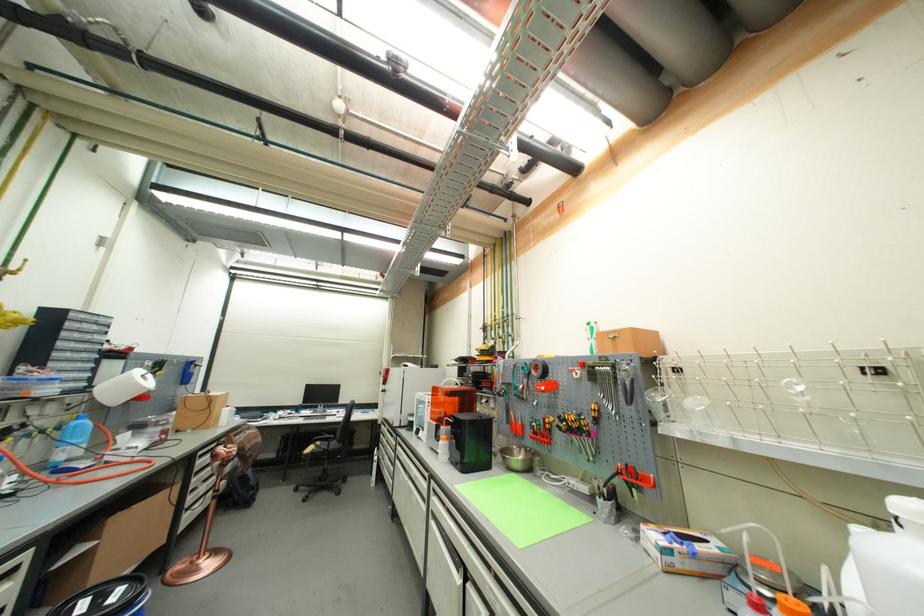
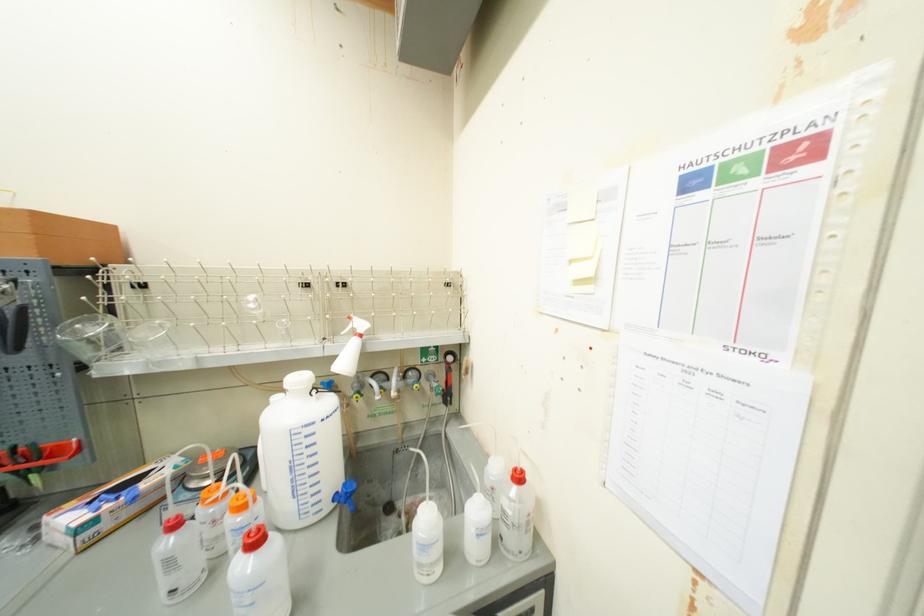
Where in the second image is the point corresponding to the highlighted location from the first image?

(13, 453)